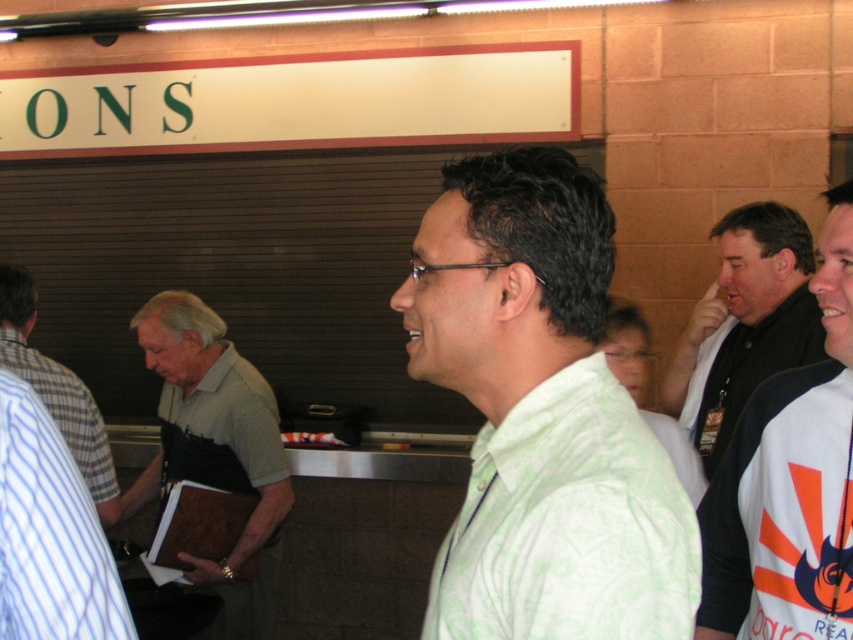
Question: Based on their relative distances, which object is farther from the white jersey at right?

Choices:
 (A) striped cotton shirt at left
 (B) light green patterned shirt at center

Answer: (A)

Question: Which point is closer to the camera?

Choices:
 (A) (778, 305)
 (B) (13, 340)
 (C) (218, 326)

Answer: (A)

Question: Is white jersey at right thinner than light green patterned shirt at center?

Choices:
 (A) yes
 (B) no

Answer: (A)

Question: Does light green printed shirt at center appear over white jersey at right?

Choices:
 (A) yes
 (B) no

Answer: (A)

Question: Among these points, which one is nearest to the camera?

Choices:
 (A) (824, 600)
 (B) (659, 412)
 (C) (229, 637)

Answer: (A)

Question: Is gray fabric shirt at left positioned in front of striped cotton shirt at left?

Choices:
 (A) yes
 (B) no

Answer: (B)